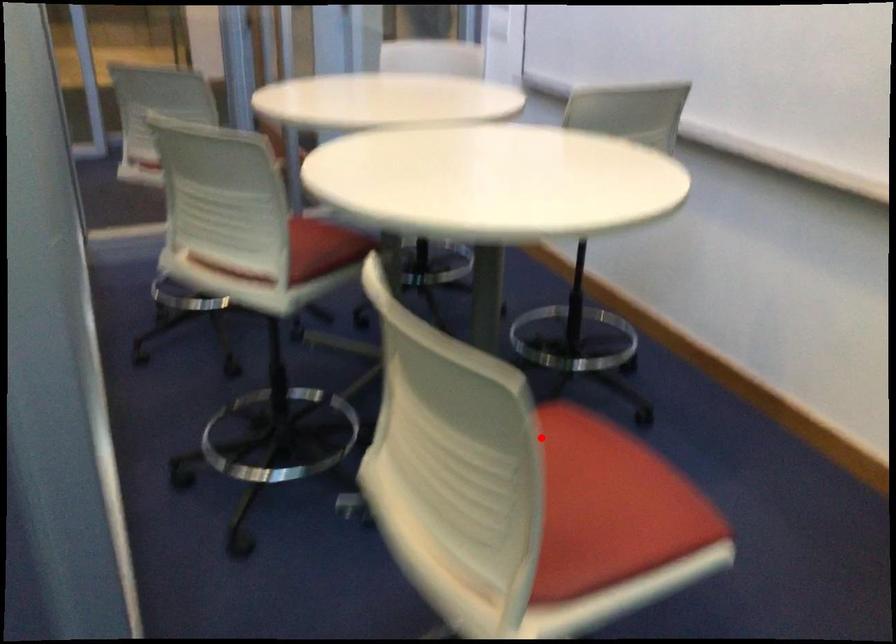
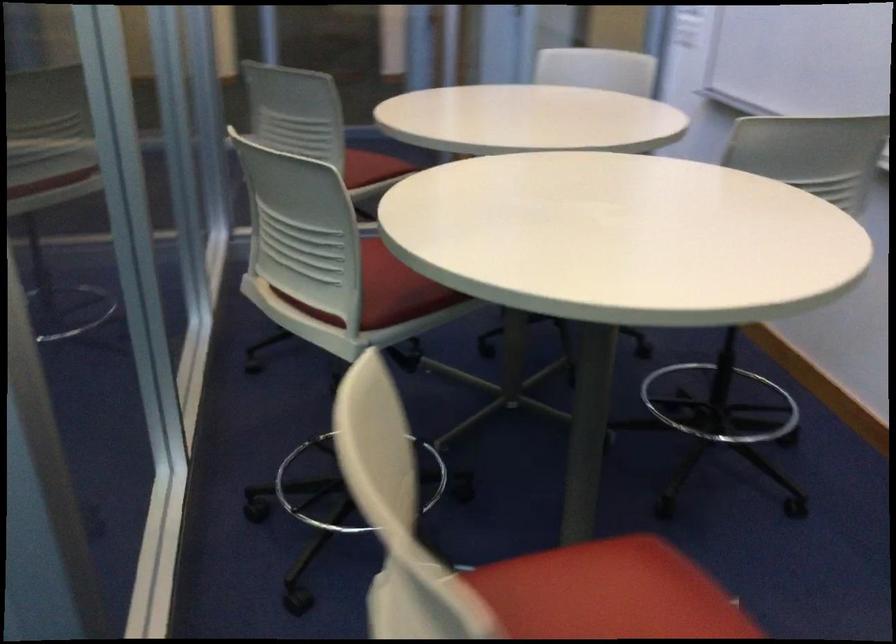
Question: I am providing you with two images of the same scene from different viewpoints. Given a red point in image1, look at the same physical point in image2. Is it:

Choices:
 (A) Closer to the viewpoint
 (B) Farther from the viewpoint

Answer: (A)